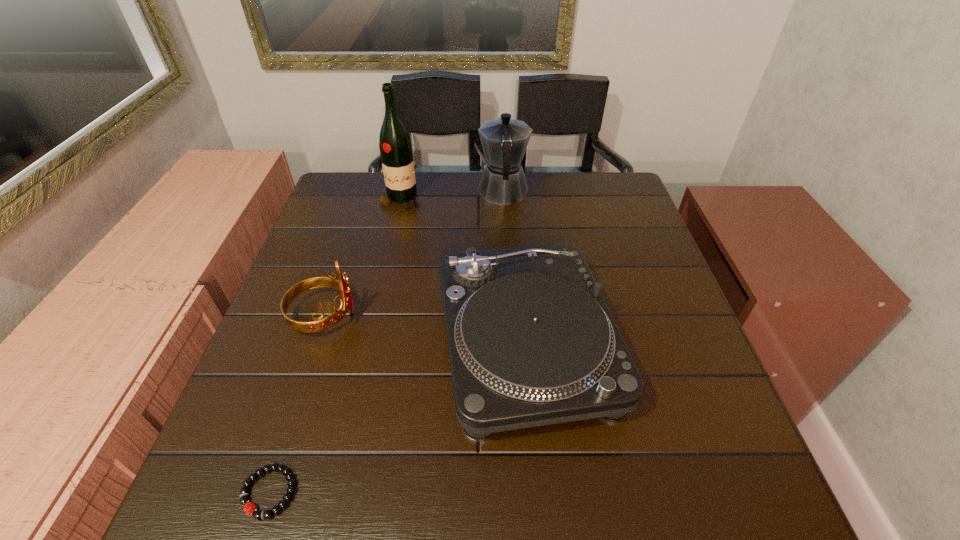
Where is `the tallest object`? the tallest object is located at coordinates (395, 145).

Identify the location of coffeepot. (504, 140).

What are the coordinates of `tiara` in the screenshot? It's located at (320, 324).

This screenshot has height=540, width=960. Find the location of `the fourth tallest object`. the fourth tallest object is located at coordinates (531, 340).

Locate an element on the screen. This screenshot has width=960, height=540. the shortest object is located at coordinates (249, 508).

Locate an element on the screen. The height and width of the screenshot is (540, 960). bracelet is located at coordinates (249, 508).

What are the coordinates of `vacant space situated on the right of the wine bottle` in the screenshot? It's located at (481, 200).

The width and height of the screenshot is (960, 540). Find the location of `vacant space located 0.080m on the front-facing side of the tiara`. vacant space located 0.080m on the front-facing side of the tiara is located at coordinates (394, 316).

In order to click on vacant area located 0.220m on the left of the record player in this screenshot , I will do `click(334, 343)`.

Locate an element on the screen. The image size is (960, 540). vacant space situated 0.070m on the back of the shortest object is located at coordinates (291, 427).